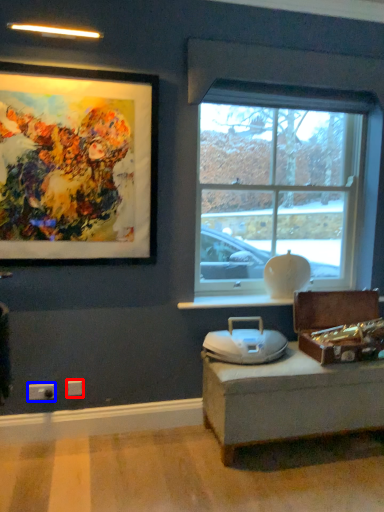
Question: Which object is closer to the camera taking this photo, electric outlet (highlighted by a red box) or electric outlet (highlighted by a blue box)?

Choices:
 (A) electric outlet
 (B) electric outlet

Answer: (B)